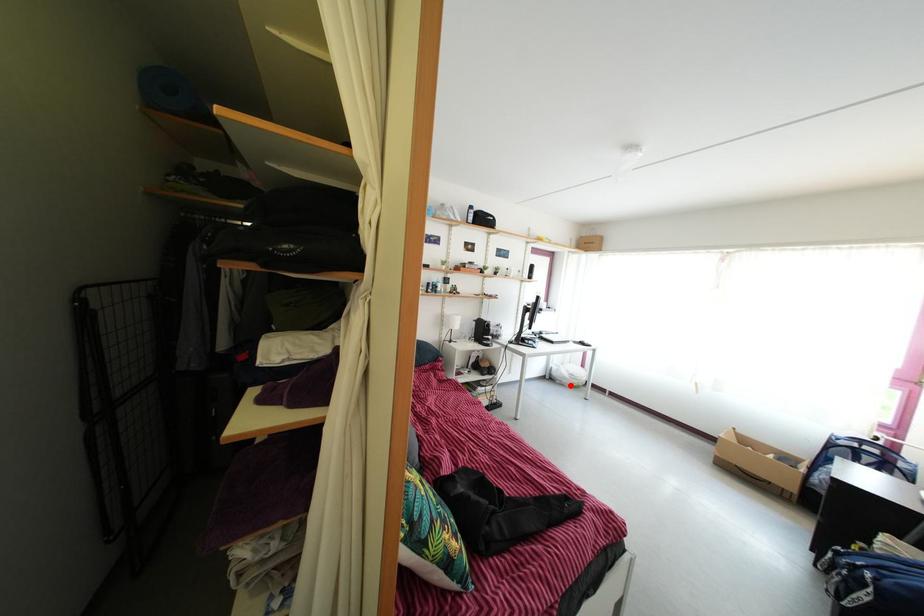
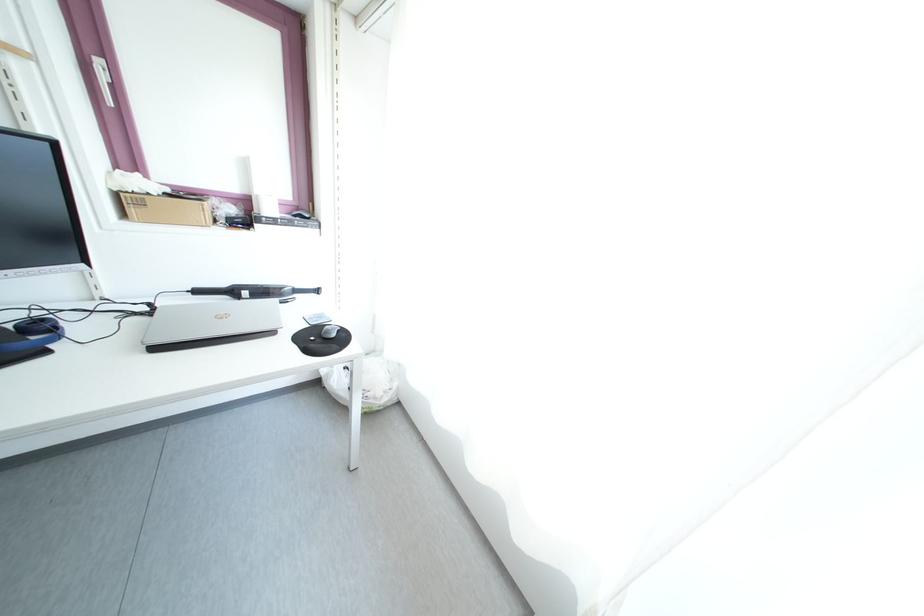
Question: I am providing you with two images of the same scene from different viewpoints. A red point is shown in image1. For the corresponding object point in image2, is it positioned nearer or farther from the camera?

Choices:
 (A) Nearer
 (B) Farther

Answer: (B)